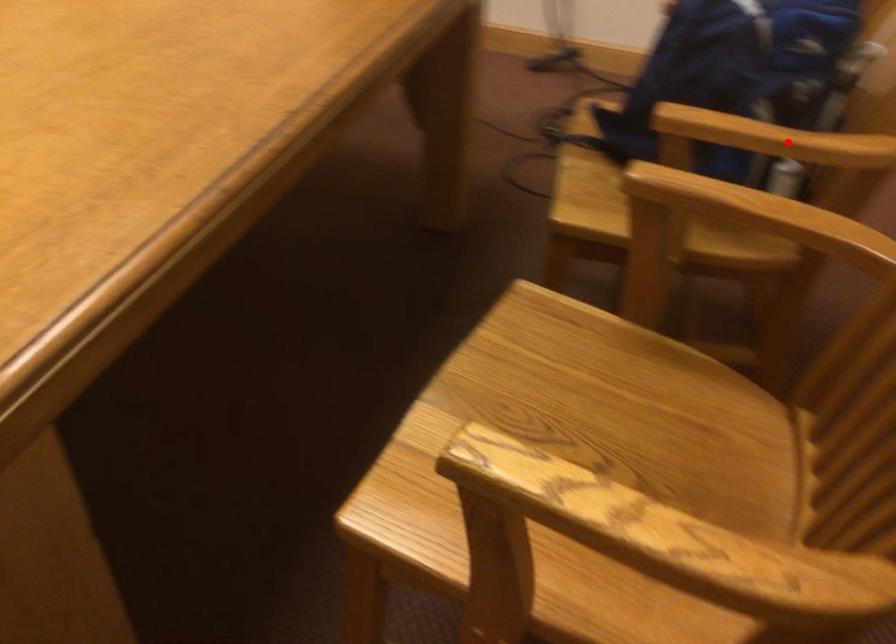
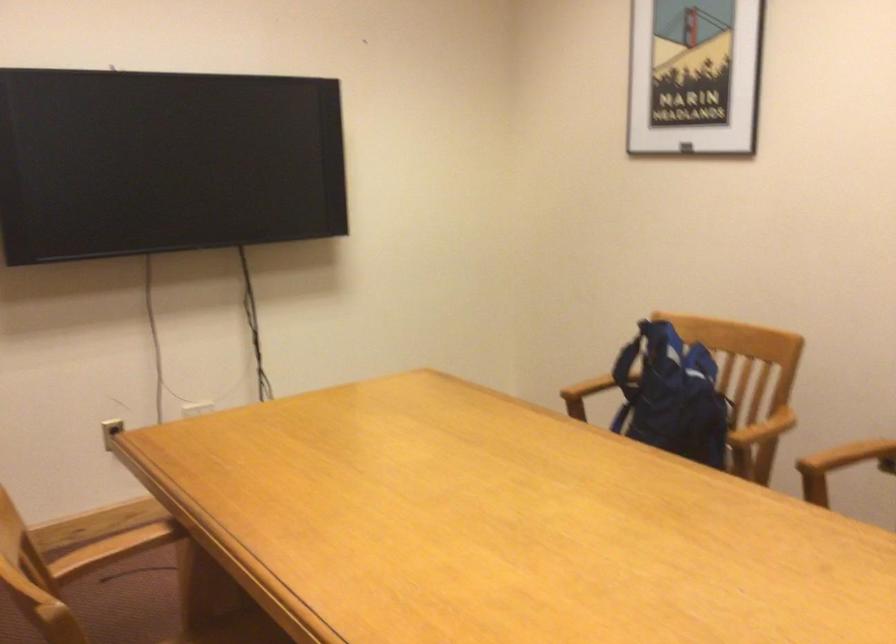
Question: I am providing you with two images of the same scene from different viewpoints. Image1 has a red point marked. In image2, the corresponding 3D location appears at what relative position? Reply with the corresponding letter.

Choices:
 (A) Closer
 (B) Farther

Answer: (B)